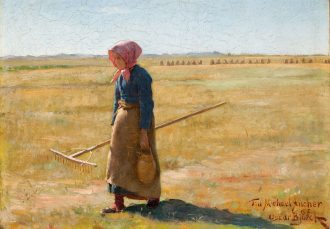
Find the location of a particular element. The height and width of the screenshot is (229, 330). art is located at coordinates (137, 62).